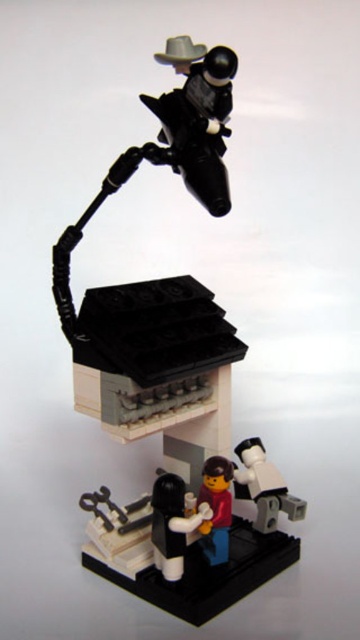
You are a barista preparing drinks and see both the matte black coffee cup at lower center and the smooth plastic cup at lower center. Which cup is shorter in height?

The matte black coffee cup at lower center is not as tall as the smooth plastic cup at lower center, so the matte black coffee cup at lower center is shorter.

You are standing in front of a LEGO diorama with a cowboy on a mechanical arm attached to a small building. There is a point marked at coordinates (x=154, y=595). Can you estimate how far this point is from your current position?

The point at (x=154, y=595) is 36.08 inches away from the viewer.